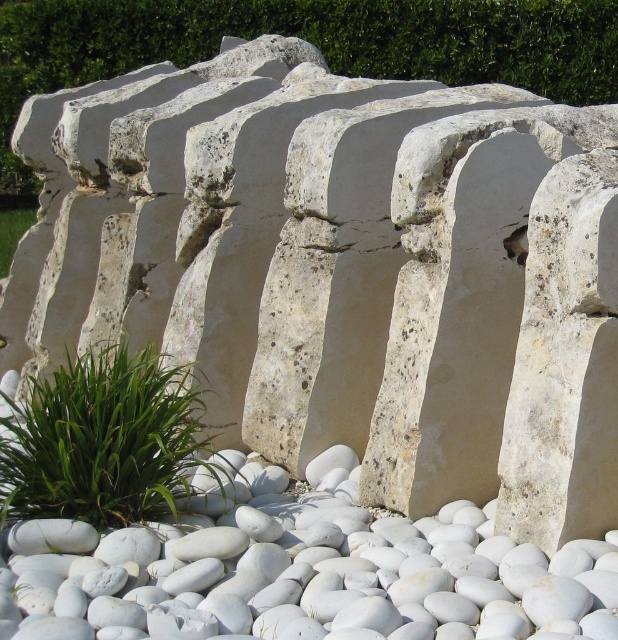
Question: Does white smooth pebble at center have a greater width compared to green leafy plant at lower left?

Choices:
 (A) yes
 (B) no

Answer: (A)

Question: Which object is farther from the camera taking this photo?

Choices:
 (A) green leafy plant at lower left
 (B) white smooth pebble at center
 (C) green leafy grass at lower left

Answer: (C)

Question: Which object is the farthest from the green leafy plant at lower left?

Choices:
 (A) green leafy grass at lower left
 (B) white smooth pebble at center

Answer: (A)

Question: Is the position of white smooth pebble at center less distant than that of green leafy grass at lower left?

Choices:
 (A) no
 (B) yes

Answer: (B)

Question: Is white smooth pebble at center further to camera compared to green leafy grass at lower left?

Choices:
 (A) yes
 (B) no

Answer: (B)

Question: Which point is closer to the camera?

Choices:
 (A) (193, 392)
 (B) (177, 634)
 (C) (1, 228)

Answer: (B)